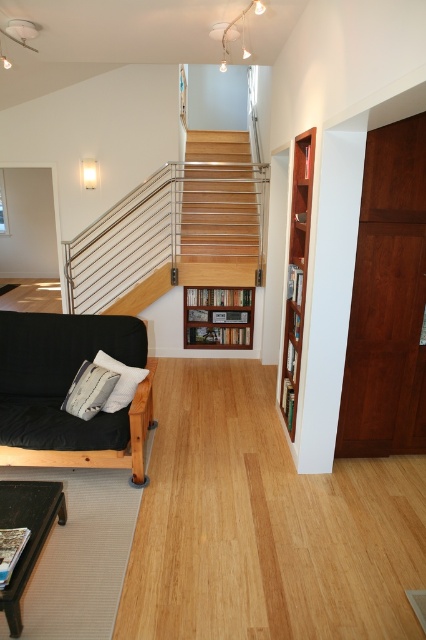
You are trying to decide whether to place a large potted plant on the wooden stairs at center or the white soft pillow at left. Based on their sizes, which location would be more suitable for the plant?

The wooden stairs at center is larger in size than the white soft pillow at left, so placing the large potted plant on the wooden stairs at center would be more suitable as it can accommodate the plant better.

You are standing in the living room and want to place a new plant on the wooden bookshelf at center. Based on the scene description, where exactly is the wooden bookshelf positioned?

The wooden bookshelf at center is located at point coordinates of (218, 316). This means it is centrally positioned in the room, making it an ideal spot for the plant.